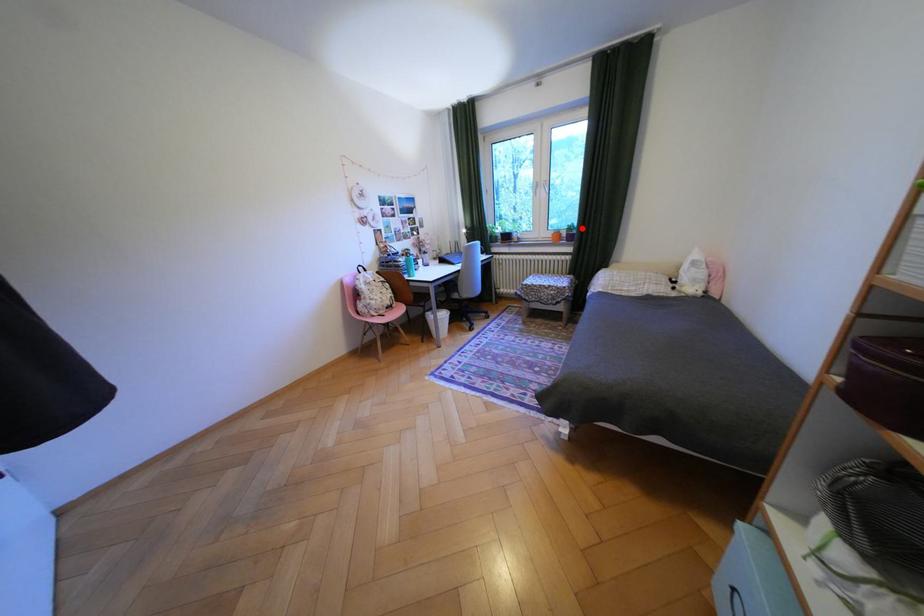
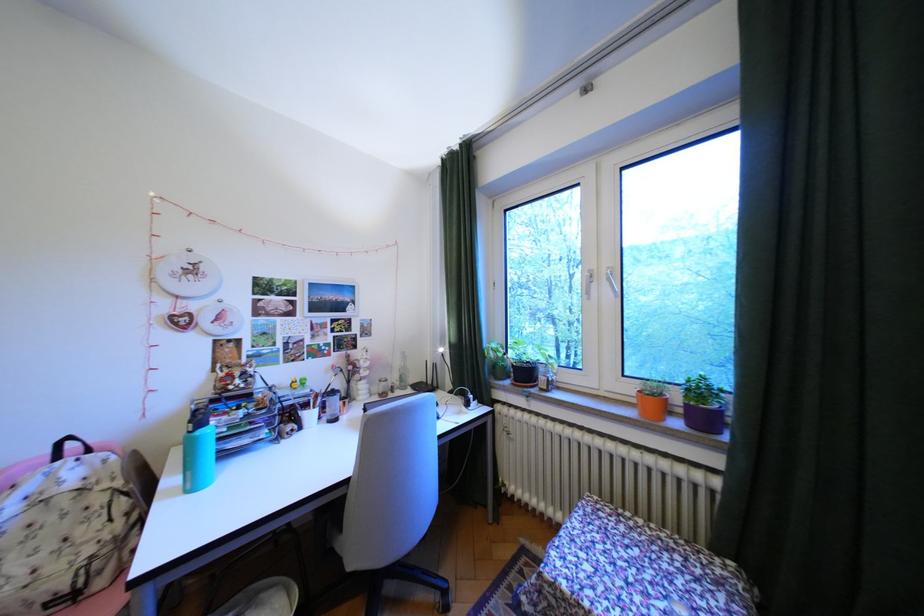
Find the pixel in the second image that matches the highlighted location in the first image.

(710, 391)